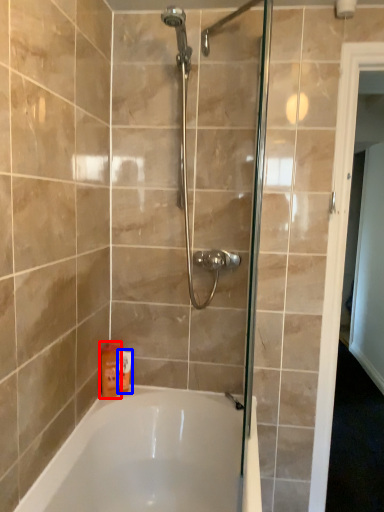
Question: Among these objects, which one is nearest to the camera, toiletry (highlighted by a red box) or toiletry (highlighted by a blue box)?

Choices:
 (A) toiletry
 (B) toiletry

Answer: (A)